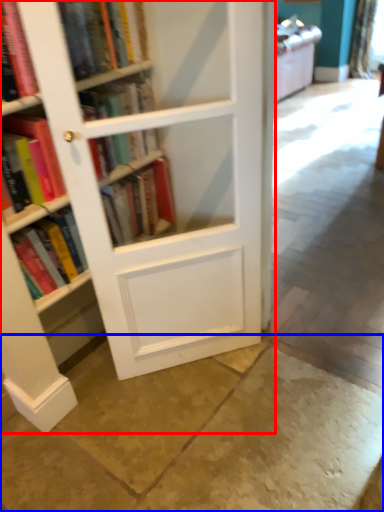
Question: Which object is closer to the camera taking this photo, bookcase (highlighted by a red box) or concrete (highlighted by a blue box)?

Choices:
 (A) bookcase
 (B) concrete

Answer: (B)